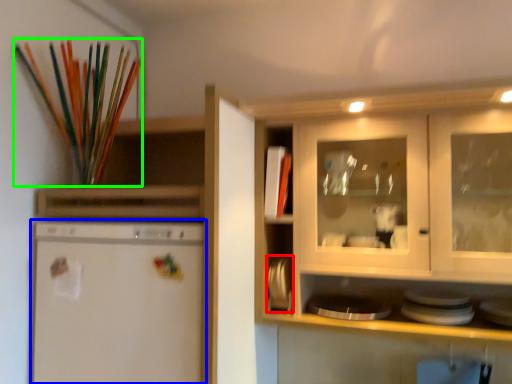
Question: Which object is the closest to the appliance (highlighted by a red box)? Choose among these: home appliance (highlighted by a blue box) or paint brush (highlighted by a green box).

Choices:
 (A) home appliance
 (B) paint brush

Answer: (A)